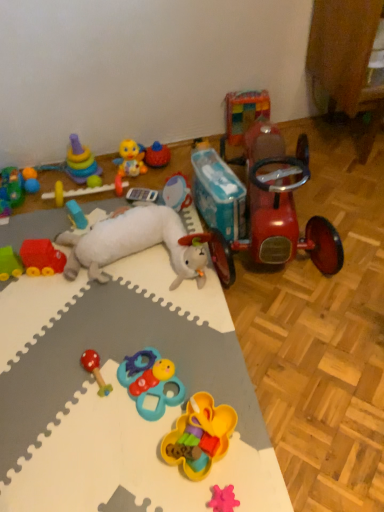
You are a GUI agent. You are given a task and a screenshot of the screen. Output one action in this format:
    pyautogui.click(x=<x>, y=<y>)
    Task: Click on the vacant space to the left of blue rubber rattle at center, marked as the 8th toy in a left-to-right arrangement
    
    Given the screenshot: What is the action you would take?
    pyautogui.click(x=90, y=395)